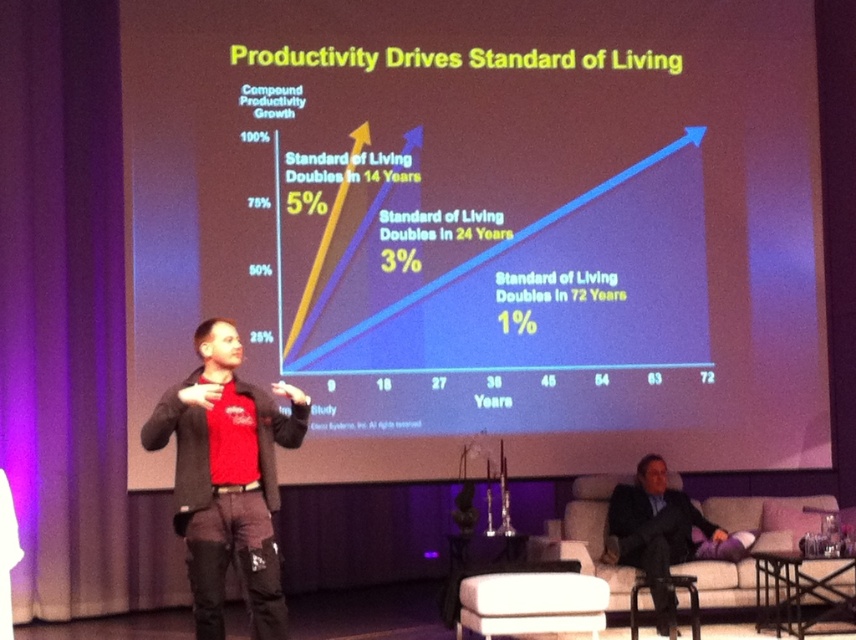
You are organizing a small event and need to place a 2.5 meter long table between the red cotton shirt at center and the black suit at lower right. Will there be enough space to place the table without moving either object?

The distance between the red cotton shirt at center and the black suit at lower right is 3.30 meters. Since the table is 2.5 meters long, there is sufficient space to place it between them without moving either object.

You are an event organizer setting up the presentation room. You need to ensure that both the white matte projection screen at upper center and the black suit at lower right are visible to all attendees. Considering their sizes, which object might require a closer viewing position to be seen clearly?

The white matte projection screen at upper center has a smaller size compared to the black suit at lower right, so it might require a closer viewing position to be seen clearly.

You are an attendee at this presentation. You want to take a photo of both the white matte projection screen at upper center and the red cotton shirt at center. However, your camera can only focus on one object at a time. Which object should you focus on first to ensure it appears larger in the photo?

The red cotton shirt at center appears larger in the scene than the white matte projection screen at upper center, so you should focus on the red cotton shirt at center first to capture its larger size in the photo.